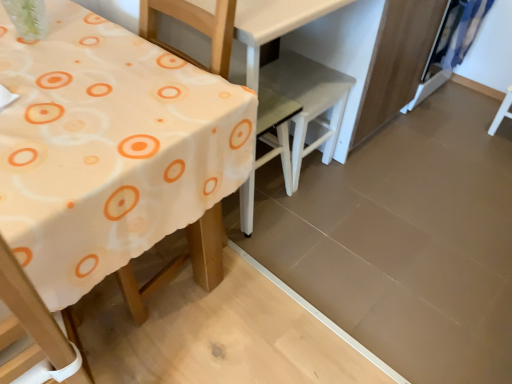
Question: Considering the positions of white plastic chair at center, the second chair when ordered from left to right, and white plastic chair at center, arranged as the first chair when viewed from the left, in the image, is white plastic chair at center, the second chair when ordered from left to right, bigger or smaller than white plastic chair at center, arranged as the first chair when viewed from the left,?

Choices:
 (A) big
 (B) small

Answer: (A)

Question: From their relative heights in the image, would you say white plastic chair at center, the second chair when ordered from left to right, is taller or shorter than white plastic chair at center, arranged as the first chair when viewed from the left?

Choices:
 (A) short
 (B) tall

Answer: (A)

Question: Which is farther from the white fabric table at left?

Choices:
 (A) white plastic chair at center, the second chair when ordered from left to right
 (B) white plastic chair at center, the second chair from the right
 (C) blue fabric curtain at upper right

Answer: (C)

Question: Which is farther from the blue fabric curtain at upper right?

Choices:
 (A) white fabric table at left
 (B) white plastic chair at center, arranged as the first chair when viewed from the left
 (C) white plastic chair at center, the second chair when ordered from left to right

Answer: (A)